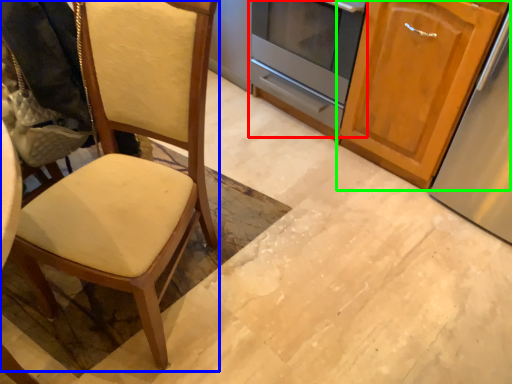
Question: Which is farther away from oven (highlighted by a red box)? chair (highlighted by a blue box) or cabinetry (highlighted by a green box)?

Choices:
 (A) chair
 (B) cabinetry

Answer: (A)